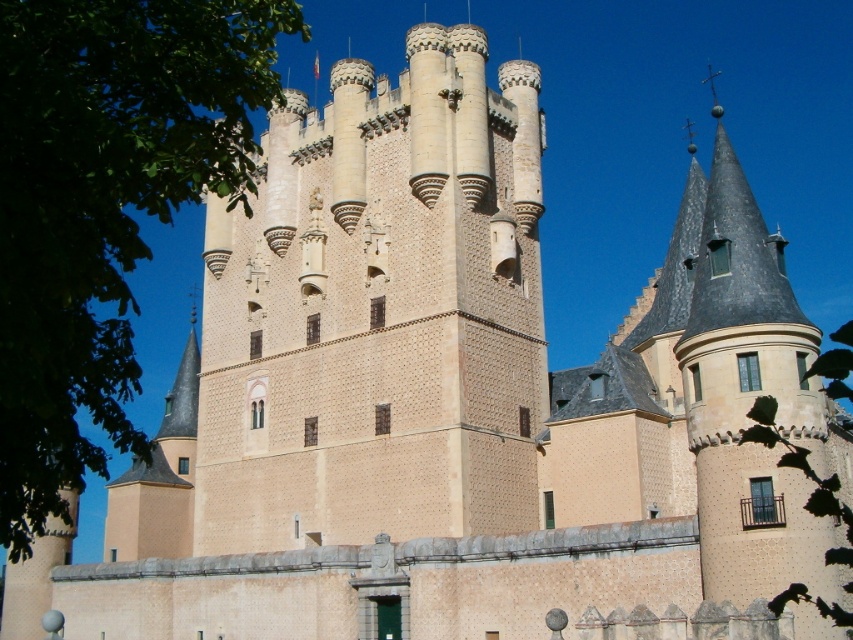
Can you confirm if beige stone tower at center is shorter than green leafy tree at upper left?

No.

Is beige stone tower at center smaller than green leafy tree at upper left?

Indeed, beige stone tower at center has a smaller size compared to green leafy tree at upper left.

Which is behind, point (405, 500) or point (50, 280)?

Point (405, 500)

Identify the location of beige stone tower at center. (378, 312).